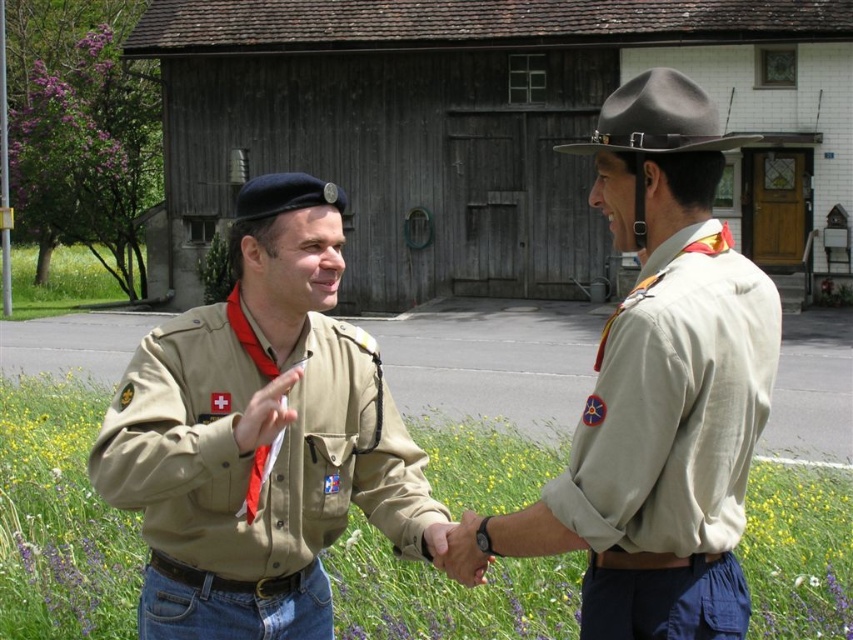
You are a photographer trying to capture a clear shot of the smooth leather hand at center. However, the brown felt cowboy hat at upper center is blocking your view. Can you move the hat to the side to get an unobstructed view of the hand?

The brown felt cowboy hat at upper center is in front of the smooth leather hand at center, so moving the hat to the side would allow you to see the hand clearly.

You are standing in the rural setting where the two scouts are shaking hands. You need to locate the khaki uniform at center. According to the coordinates provided, where would you find it?

The khaki uniform at center is located at point (660, 387).